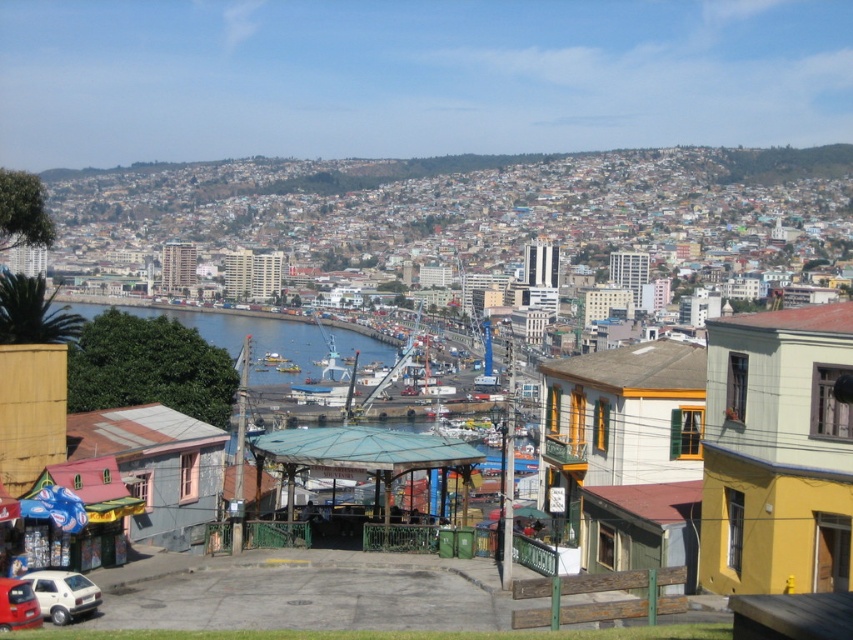
Question: Which point appears farthest from the camera in this image?

Choices:
 (A) 268,368
 (B) 22,612
 (C) 39,593

Answer: (A)

Question: Which point appears closest to the camera in this image?

Choices:
 (A) (53, 620)
 (B) (277, 339)

Answer: (A)

Question: Does white matte car at lower left appear on the left side of metallic red car at lower left?

Choices:
 (A) yes
 (B) no

Answer: (B)

Question: Observing the image, what is the correct spatial positioning of blue water at center in reference to white matte car at lower left?

Choices:
 (A) right
 (B) left

Answer: (B)

Question: Does white matte car at lower left appear on the right side of metallic red car at lower left?

Choices:
 (A) yes
 (B) no

Answer: (A)

Question: Among these objects, which one is farthest from the camera?

Choices:
 (A) metallic red car at lower left
 (B) blue water at center

Answer: (B)